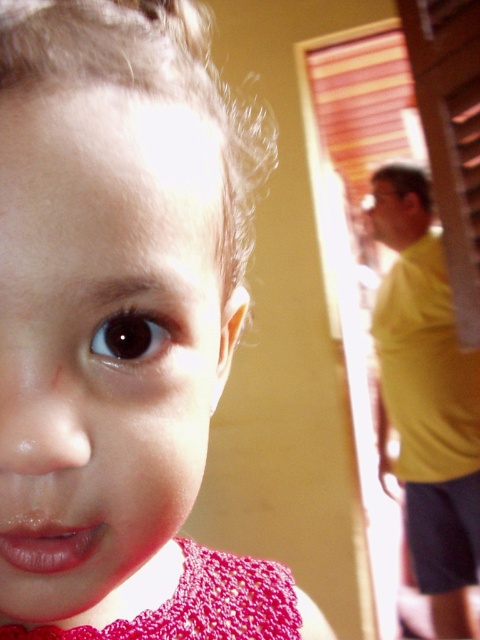
Question: Among these points, which one is nearest to the camera?

Choices:
 (A) (439, 586)
 (B) (82, 380)
 (C) (243, 593)

Answer: (B)

Question: Which point is farther from the camera taking this photo?

Choices:
 (A) (196, 621)
 (B) (439, 429)

Answer: (B)

Question: Which object appears farthest from the camera in this image?

Choices:
 (A) yellow matte shirt at right
 (B) matte pink lace dress at center

Answer: (A)

Question: Can you confirm if yellow matte shirt at right is positioned to the left of crochet fabric dress at lower left?

Choices:
 (A) yes
 (B) no

Answer: (B)

Question: Does matte pink lace dress at center appear on the right side of crochet fabric dress at lower left?

Choices:
 (A) yes
 (B) no

Answer: (B)

Question: Does matte pink lace dress at center come behind crochet fabric dress at lower left?

Choices:
 (A) no
 (B) yes

Answer: (A)